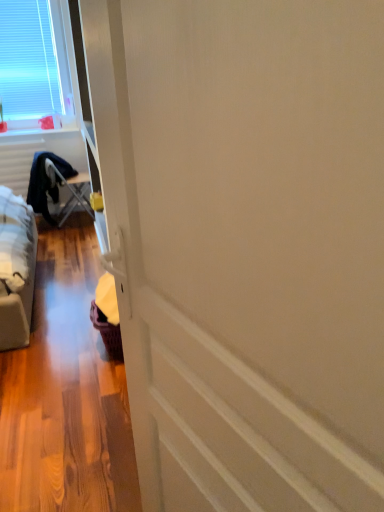
Question: Considering the relative sizes of metallic silver folding table at left and white plastic window at upper left in the image provided, is metallic silver folding table at left wider than white plastic window at upper left?

Choices:
 (A) yes
 (B) no

Answer: (A)

Question: Is white plastic window at upper left a part of metallic silver folding table at left?

Choices:
 (A) no
 (B) yes

Answer: (A)

Question: From a real-world perspective, is metallic silver folding table at left physically above white plastic window at upper left?

Choices:
 (A) yes
 (B) no

Answer: (B)

Question: Are metallic silver folding table at left and white plastic window at upper left beside each other?

Choices:
 (A) no
 (B) yes

Answer: (A)

Question: From the image's perspective, would you say metallic silver folding table at left is positioned over white plastic window at upper left?

Choices:
 (A) no
 (B) yes

Answer: (A)

Question: Would you consider metallic silver folding table at left to be distant from white plastic window at upper left?

Choices:
 (A) no
 (B) yes

Answer: (A)

Question: Is white plastic window at upper left far from metallic silver folding table at left?

Choices:
 (A) no
 (B) yes

Answer: (A)

Question: Can you confirm if white plastic window at upper left is thinner than metallic silver folding table at left?

Choices:
 (A) yes
 (B) no

Answer: (A)

Question: Would you say white plastic window at upper left is outside metallic silver folding table at left?

Choices:
 (A) no
 (B) yes

Answer: (B)

Question: Is metallic silver folding table at left at the back of white plastic window at upper left?

Choices:
 (A) no
 (B) yes

Answer: (A)

Question: Considering the relative sizes of white plastic window at upper left and metallic silver folding table at left in the image provided, is white plastic window at upper left smaller than metallic silver folding table at left?

Choices:
 (A) no
 (B) yes

Answer: (B)

Question: From a real-world perspective, is white plastic window at upper left under metallic silver folding table at left?

Choices:
 (A) no
 (B) yes

Answer: (A)

Question: In terms of height, does white plastic window at upper left look taller or shorter compared to metallic silver folding table at left?

Choices:
 (A) tall
 (B) short

Answer: (A)